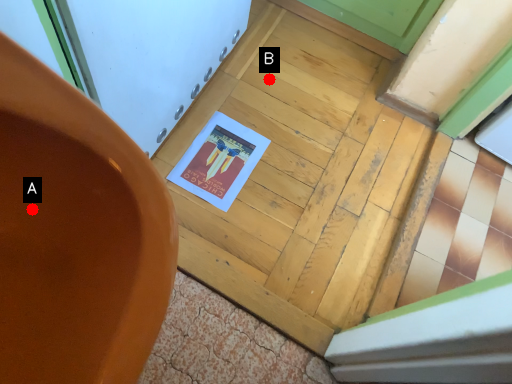
Question: Two points are circled on the image, labeled by A and B beside each circle. Which point appears farthest from the camera in this image?

Choices:
 (A) A is further
 (B) B is further

Answer: (B)